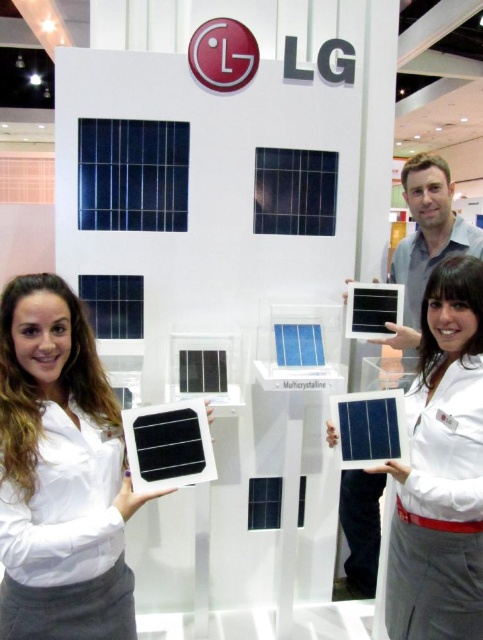
You are a visitor at the exhibition and want to take a photo of both the matte black solar panel at left and the matte black solar panel at center. Which one should you stand closer to to capture both in your frame?

You should stand closer to the matte black solar panel at center because the matte black solar panel at left is positioned to its left side, so centering your focus on the central panel will allow both to be captured in the frame.